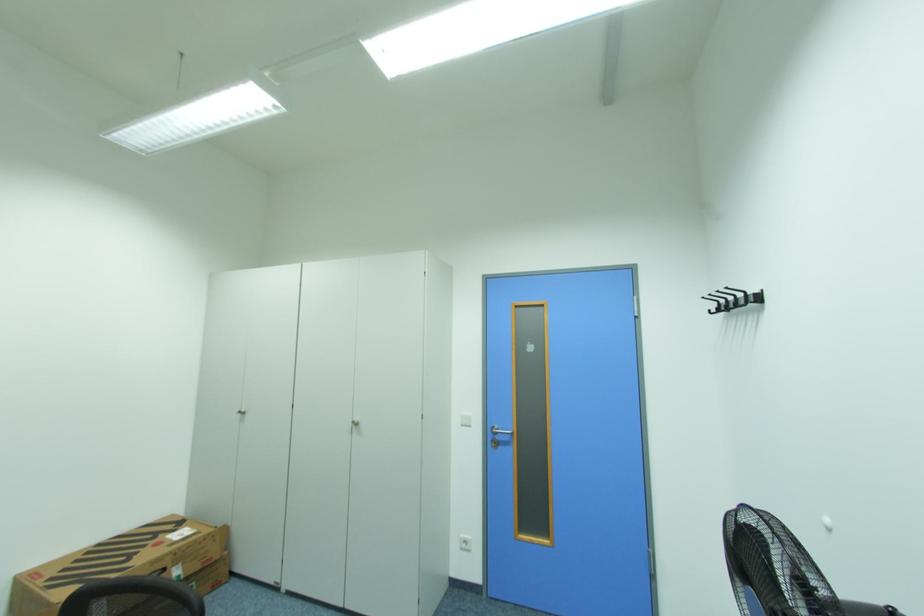
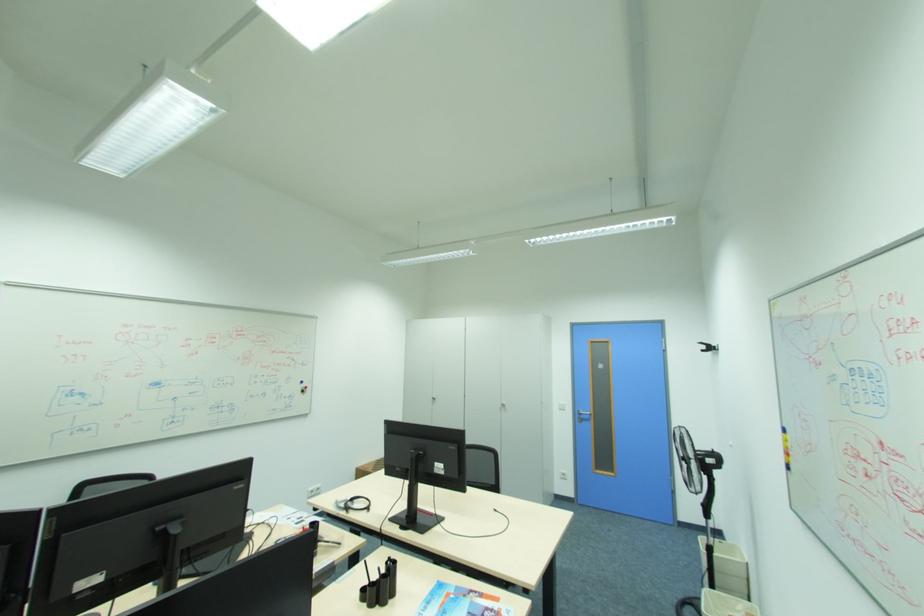
In the second image, find the point that corresponds to [504,438] in the first image.

(588, 416)